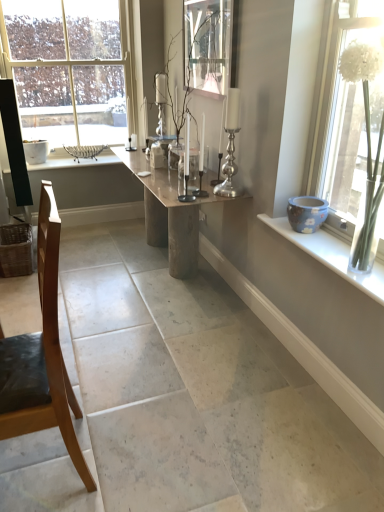
You are a GUI agent. You are given a task and a screenshot of the screen. Output one action in this format:
    pyautogui.click(x=<x>, y=<y>)
    Task: Click on the unoccupied space behind clear glass candle holder at center, the second candle holder viewed from the right
    This screenshot has width=384, height=512.
    Given the screenshot: What is the action you would take?
    pyautogui.click(x=198, y=187)